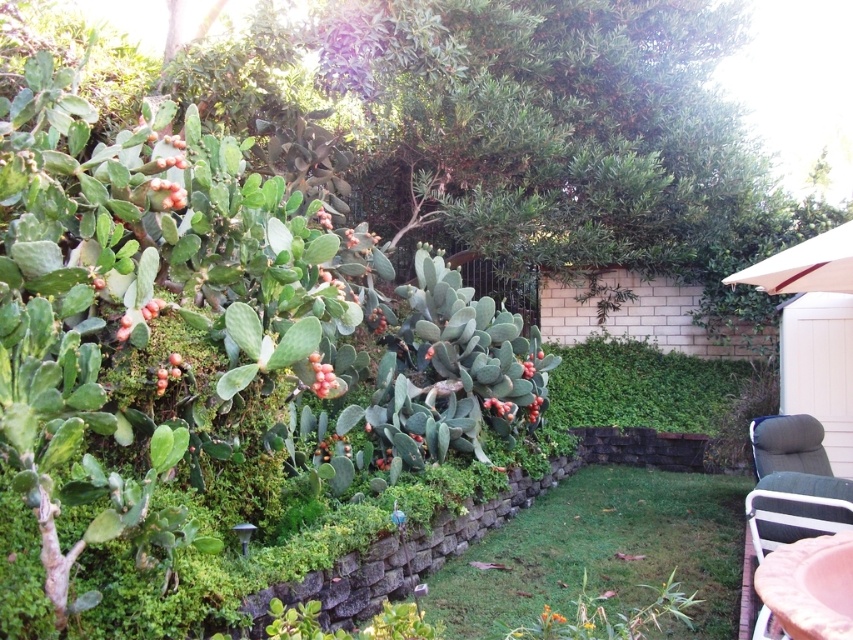
Question: Which of the following is the closest to the observer?

Choices:
 (A) (775, 532)
 (B) (509, 593)
 (C) (805, 438)

Answer: (A)

Question: Is pink fabric chair at lower right below gray fabric chair at lower right?

Choices:
 (A) no
 (B) yes

Answer: (A)

Question: Which point is closer to the camera?

Choices:
 (A) pink fabric chair at lower right
 (B) gray fabric chair at lower right
 (C) green grass at center

Answer: (C)

Question: From the image, what is the correct spatial relationship of green grass at center in relation to pink fabric chair at lower right?

Choices:
 (A) above
 (B) below

Answer: (B)

Question: Does green grass at center appear on the right side of gray fabric chair at lower right?

Choices:
 (A) no
 (B) yes

Answer: (A)

Question: Which of the following is the closest to the observer?

Choices:
 (A) (740, 508)
 (B) (786, 484)
 (C) (759, 468)

Answer: (B)